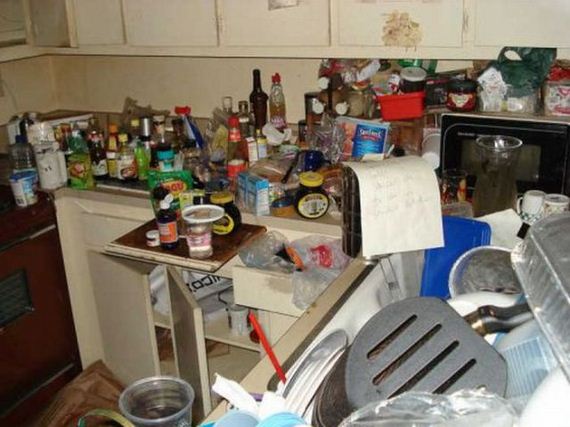
At what (x,y) coordinates should I click in order to perform the action: click on upside down coffee cup. Please return your answer as a coordinate pair (x, y). Looking at the image, I should click on (530, 205).